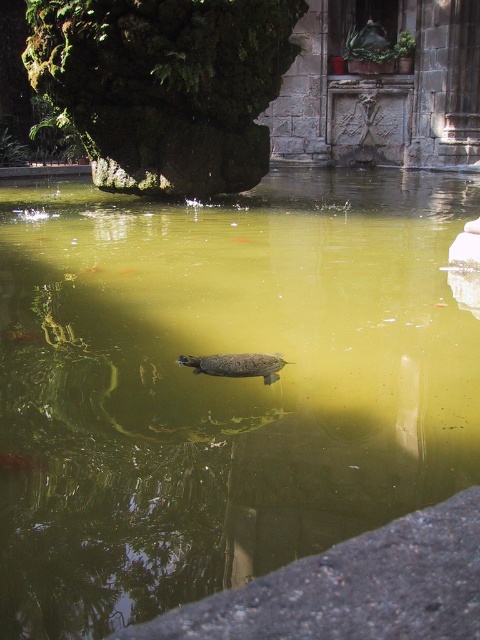
You are a small frog that can jump 1 meter. You are on the mossy rock in the upper left and want to reach the green murky water at center. Can you jump directly there in one leap?

The distance between the mossy rock in the upper left and the green murky water at center is 1.36 meters. Since the frog can only jump 1 meter, it cannot reach the green murky water at center in a single leap.

You are a photographer trying to capture a clear image of the smooth brown tortoise at center. However, the green murky water at center is obstructing your view. Can you determine if the water is between you and the tortoise, making it harder to see?

The green murky water at center is in front of the smooth brown tortoise at center, so yes, the water is between you and the tortoise, making it harder to see.

You are standing at the origin point of the coordinate system in the image. You want to locate the green murky water at center. Which direction should you move in to reach it?

The green murky water at center is located at coordinates point (220, 385), so you should move towards the right and slightly downward from your current position at the origin to reach it.